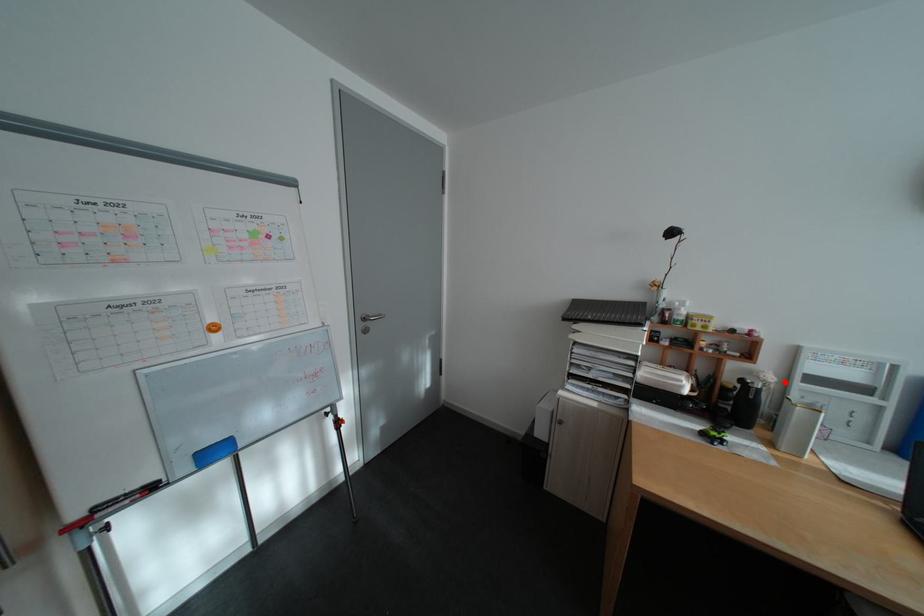
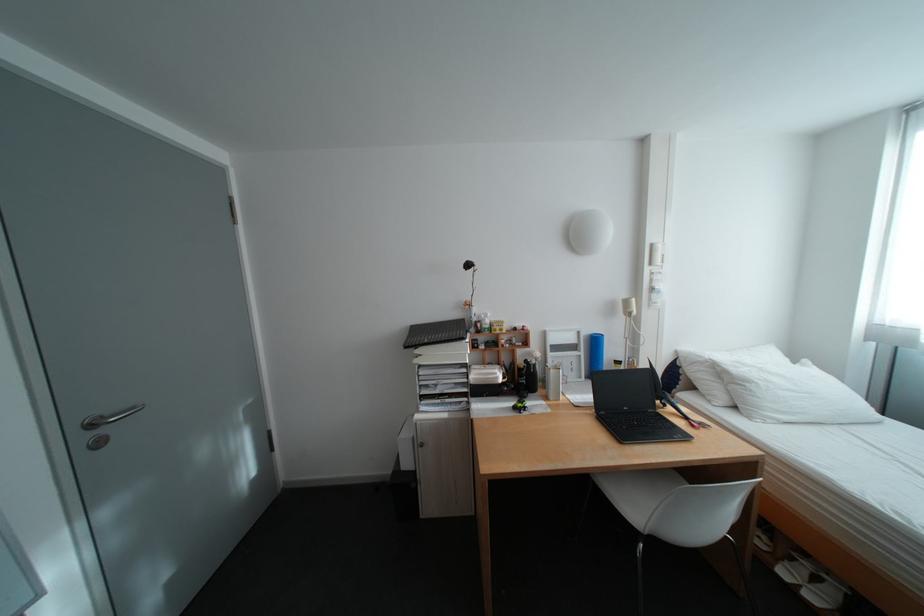
Find the pixel in the second image that matches the highlighted location in the first image.

(552, 358)